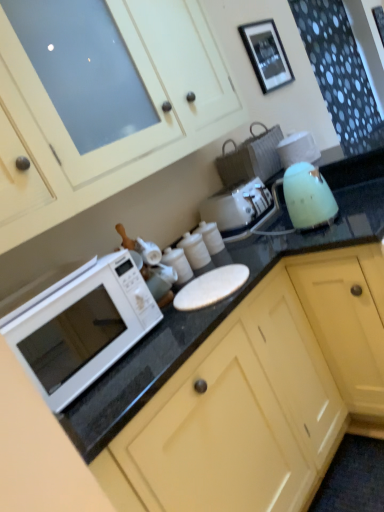
Question: Does white glossy microwave at left lie in front of matte white cabinet at upper center, the 2th cabinetry positioned from the bottom?

Choices:
 (A) no
 (B) yes

Answer: (A)

Question: Can you confirm if white glossy microwave at left is bigger than matte white cabinet at upper center, the 1th cabinetry from the top?

Choices:
 (A) no
 (B) yes

Answer: (A)

Question: Could you tell me if white glossy microwave at left is turned towards matte white cabinet at upper center, the 1th cabinetry from the top?

Choices:
 (A) no
 (B) yes

Answer: (A)

Question: From the image's perspective, would you say white glossy microwave at left is positioned over matte white cabinet at upper center, the 1th cabinetry from the top?

Choices:
 (A) yes
 (B) no

Answer: (B)

Question: Does white glossy microwave at left have a lesser width compared to matte white cabinet at upper center, the 1th cabinetry from the top?

Choices:
 (A) no
 (B) yes

Answer: (B)

Question: From a real-world perspective, is white glossy microwave at left on matte white cabinet at upper center, the 2th cabinetry positioned from the bottom?

Choices:
 (A) no
 (B) yes

Answer: (A)

Question: Is white glossy microwave at left thinner than matte yellow cabinet at lower center, the second cabinetry positioned from the top?

Choices:
 (A) yes
 (B) no

Answer: (A)

Question: Can you confirm if white glossy microwave at left is shorter than matte yellow cabinet at lower center, the second cabinetry positioned from the top?

Choices:
 (A) no
 (B) yes

Answer: (B)

Question: Can you confirm if white glossy microwave at left is wider than matte yellow cabinet at lower center, which is the first cabinetry from bottom to top?

Choices:
 (A) yes
 (B) no

Answer: (B)

Question: Considering the relative sizes of white glossy microwave at left and matte yellow cabinet at lower center, the second cabinetry positioned from the top, in the image provided, is white glossy microwave at left bigger than matte yellow cabinet at lower center, the second cabinetry positioned from the top,?

Choices:
 (A) no
 (B) yes

Answer: (A)

Question: From a real-world perspective, is white glossy microwave at left on top of matte yellow cabinet at lower center, the second cabinetry positioned from the top?

Choices:
 (A) yes
 (B) no

Answer: (A)

Question: From the image's perspective, is white glossy microwave at left above matte yellow cabinet at lower center, the second cabinetry positioned from the top?

Choices:
 (A) yes
 (B) no

Answer: (A)

Question: Is matte white cabinet at upper center, the 1th cabinetry from the top, bigger than black matte picture frame at upper center?

Choices:
 (A) yes
 (B) no

Answer: (A)